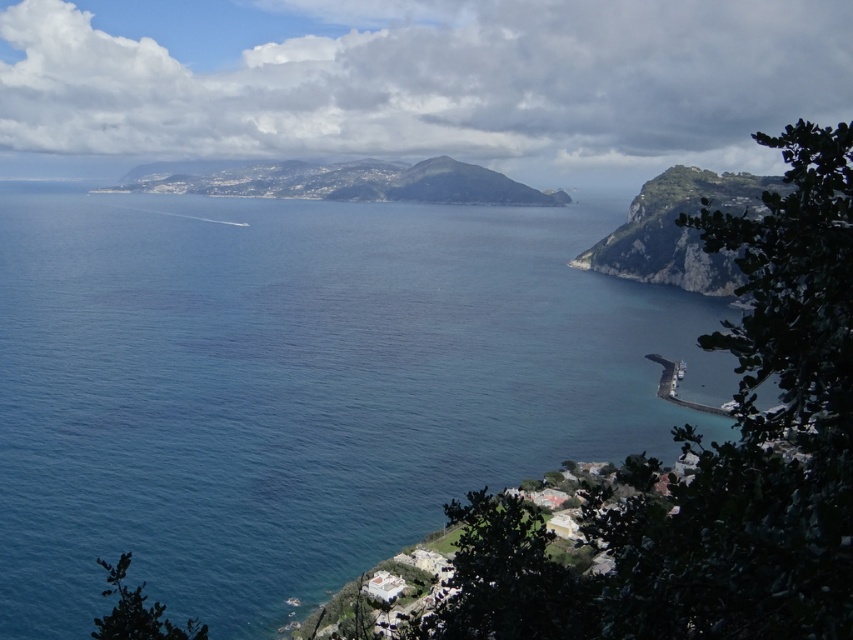
Question: Can you confirm if blue water at center is positioned below rugged stone cliff at right?

Choices:
 (A) yes
 (B) no

Answer: (B)

Question: Among these points, which one is nearest to the camera?

Choices:
 (A) (654, 256)
 (B) (149, 518)

Answer: (B)

Question: Can you confirm if blue water at center is positioned above rugged stone cliff at right?

Choices:
 (A) yes
 (B) no

Answer: (A)

Question: Does blue water at center have a lesser width compared to rugged stone cliff at right?

Choices:
 (A) no
 (B) yes

Answer: (A)

Question: Which point appears farthest from the camera in this image?

Choices:
 (A) (695, 212)
 (B) (346, 545)

Answer: (A)

Question: Which point appears closest to the camera in this image?

Choices:
 (A) (22, 540)
 (B) (602, 262)

Answer: (A)